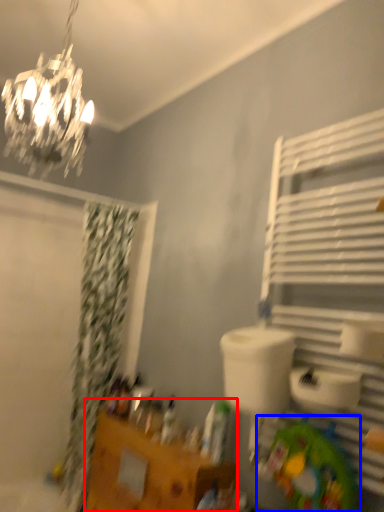
Question: Which object appears closest to the camera in this image, vanity (highlighted by a red box) or toy (highlighted by a blue box)?

Choices:
 (A) vanity
 (B) toy

Answer: (B)